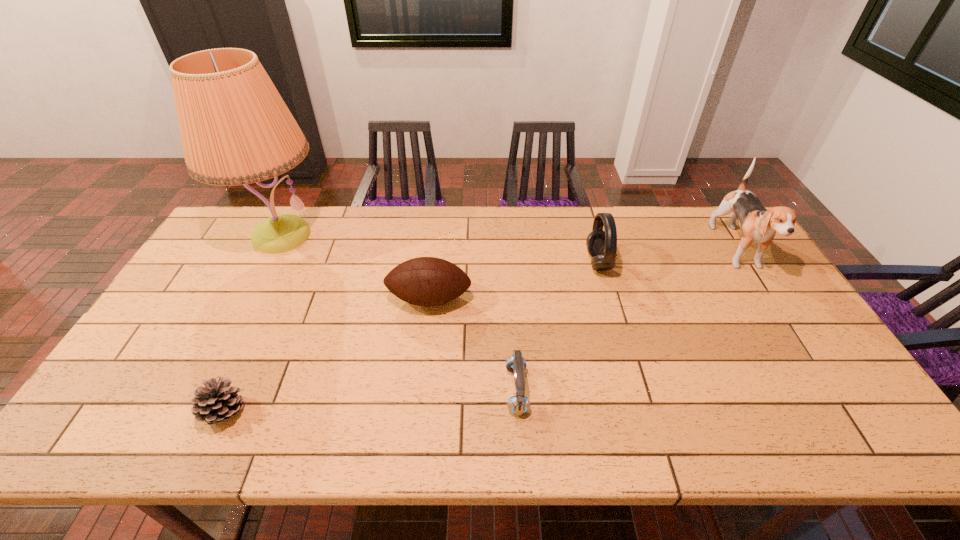
Where is `lamp that is positioned at the far edge`? The width and height of the screenshot is (960, 540). lamp that is positioned at the far edge is located at coordinates (235, 128).

What are the coordinates of `puppy at the far edge` in the screenshot? It's located at (758, 225).

Image resolution: width=960 pixels, height=540 pixels. Identify the location of headset that is positioned at the far edge. (602, 245).

This screenshot has height=540, width=960. In order to click on pinecone positioned at the near edge in this screenshot , I will do `click(217, 402)`.

You are a GUI agent. You are given a task and a screenshot of the screen. Output one action in this format:
    pyautogui.click(x=<x>, y=<y>)
    Task: Click on the headset at the near edge
    
    Given the screenshot: What is the action you would take?
    pyautogui.click(x=518, y=404)

The width and height of the screenshot is (960, 540). What are the coordinates of `object that is at the left edge` in the screenshot? It's located at (235, 128).

Identify the location of object situated at the right edge. The width and height of the screenshot is (960, 540). (758, 225).

This screenshot has height=540, width=960. I want to click on object positioned at the far left corner, so click(x=235, y=128).

Find the location of a particular element. object that is at the far right corner is located at coordinates (758, 225).

At what (x,y) coordinates should I click in order to perform the action: click on blank area at the far edge. Please return your answer as a coordinate pair (x, y). This screenshot has width=960, height=540. Looking at the image, I should click on (522, 206).